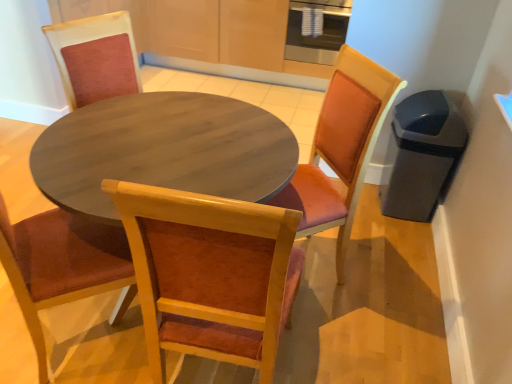
Question: Is wooden chair at center, arranged as the second chair when viewed from the back, at the right side of stainless steel oven at upper center?

Choices:
 (A) yes
 (B) no

Answer: (B)

Question: From the image's perspective, is wooden chair at center, arranged as the second chair when viewed from the back, below stainless steel oven at upper center?

Choices:
 (A) no
 (B) yes

Answer: (B)

Question: Is wooden chair at center, acting as the first chair starting from the front, positioned with its back to stainless steel oven at upper center?

Choices:
 (A) no
 (B) yes

Answer: (A)

Question: Is wooden chair at center, acting as the first chair starting from the front, smaller than stainless steel oven at upper center?

Choices:
 (A) yes
 (B) no

Answer: (B)

Question: From a real-world perspective, is wooden chair at center, acting as the first chair starting from the front, on top of stainless steel oven at upper center?

Choices:
 (A) yes
 (B) no

Answer: (B)

Question: Is wooden chair at center, arranged as the second chair when viewed from the back, taller than stainless steel oven at upper center?

Choices:
 (A) no
 (B) yes

Answer: (B)

Question: Is stainless steel oven at upper center at the right side of wooden chair with orange cushion at center, positioned as the 2th chair in front-to-back order?

Choices:
 (A) no
 (B) yes

Answer: (B)

Question: Can you confirm if stainless steel oven at upper center is taller than wooden chair with orange cushion at center, which appears as the 1th chair when viewed from the back?

Choices:
 (A) yes
 (B) no

Answer: (B)

Question: From a real-world perspective, does stainless steel oven at upper center sit lower than wooden chair with orange cushion at center, which appears as the 1th chair when viewed from the back?

Choices:
 (A) yes
 (B) no

Answer: (B)

Question: Considering the relative sizes of stainless steel oven at upper center and wooden chair with orange cushion at center, positioned as the 2th chair in front-to-back order, in the image provided, is stainless steel oven at upper center shorter than wooden chair with orange cushion at center, positioned as the 2th chair in front-to-back order,?

Choices:
 (A) yes
 (B) no

Answer: (A)

Question: Is stainless steel oven at upper center bigger than wooden chair with orange cushion at center, which appears as the 1th chair when viewed from the back?

Choices:
 (A) yes
 (B) no

Answer: (B)

Question: Considering the relative sizes of stainless steel oven at upper center and wooden chair with orange cushion at center, which appears as the 1th chair when viewed from the back, in the image provided, is stainless steel oven at upper center thinner than wooden chair with orange cushion at center, which appears as the 1th chair when viewed from the back,?

Choices:
 (A) no
 (B) yes

Answer: (B)

Question: Could you tell me if wooden chair at center, arranged as the second chair when viewed from the back, is turned towards wooden chair with orange cushion at center, positioned as the 2th chair in front-to-back order?

Choices:
 (A) yes
 (B) no

Answer: (A)